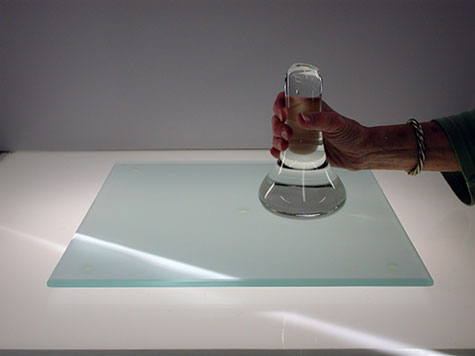
The height and width of the screenshot is (356, 475). I want to click on glass object, thin at top and round at the bottom, so click(x=303, y=149).